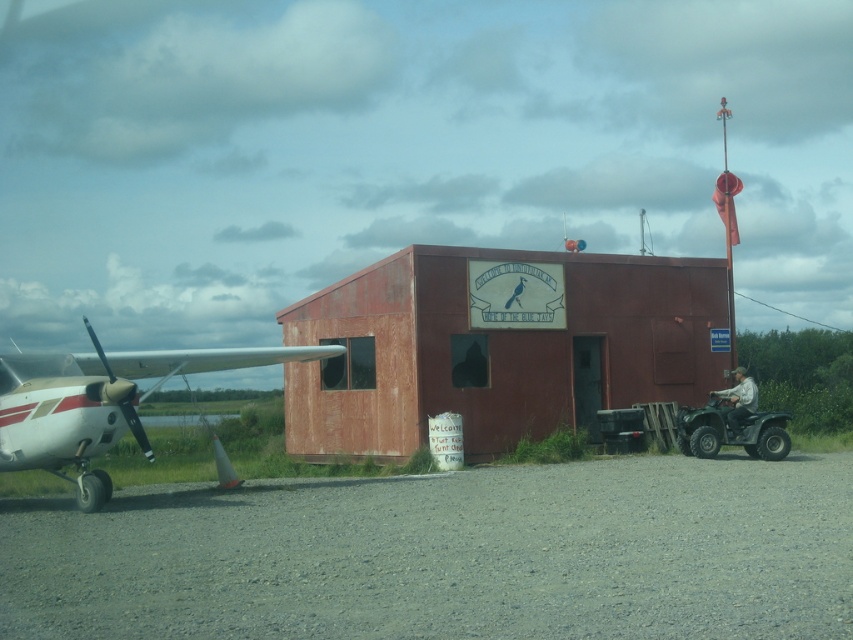
You are a pilot standing near the white glossy airplane at left and want to take a photo of the rusty wood hangar at center. Will the entire hangar fit in your camera frame if you stand where you are?

The rusty wood hangar at center is much taller than the white glossy airplane at left. Since the hangar is taller, it might not fit entirely in the camera frame from your current position unless you adjust your angle or move back.

You are standing at the entrance of the rusty wood hangar at center. If you face the direction where the small single engine aircraft with propeller is parked, which direction should you turn to see the person on the black four wheeler?

The rusty wood hangar at center is located at point (496,346). Since the aircraft is to the left of the hangar and the person is in the foreground, turning right would align you with the four wheeler.